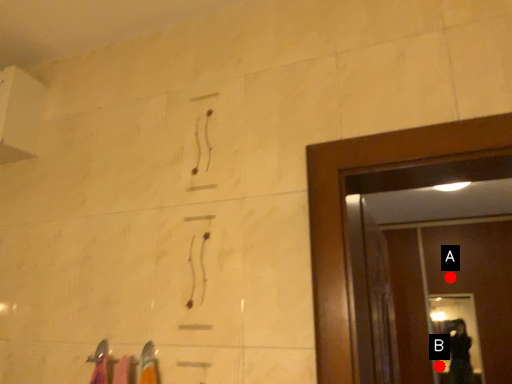
Question: Two points are circled on the image, labeled by A and B beside each circle. Which point is closer to the camera taking this photo?

Choices:
 (A) A is closer
 (B) B is closer

Answer: (B)